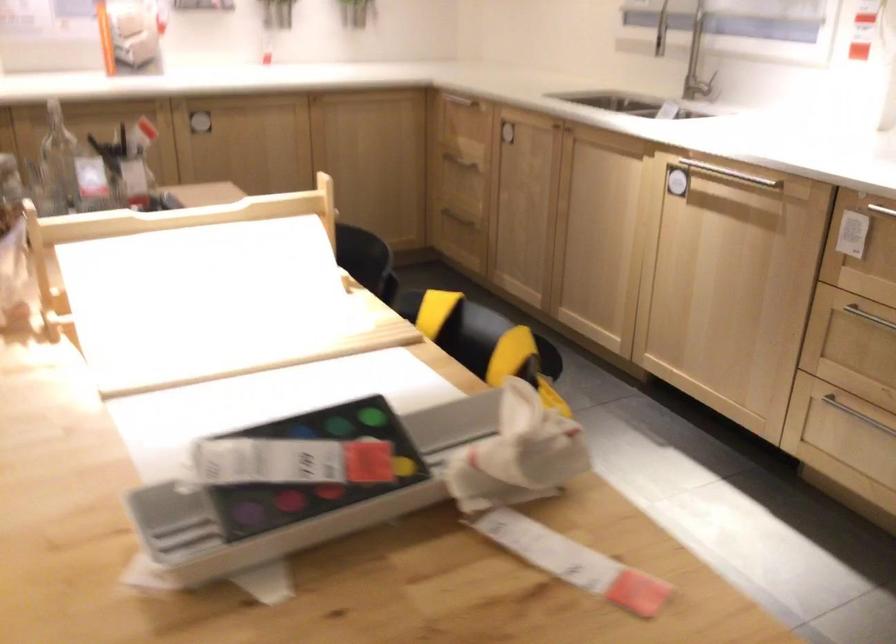
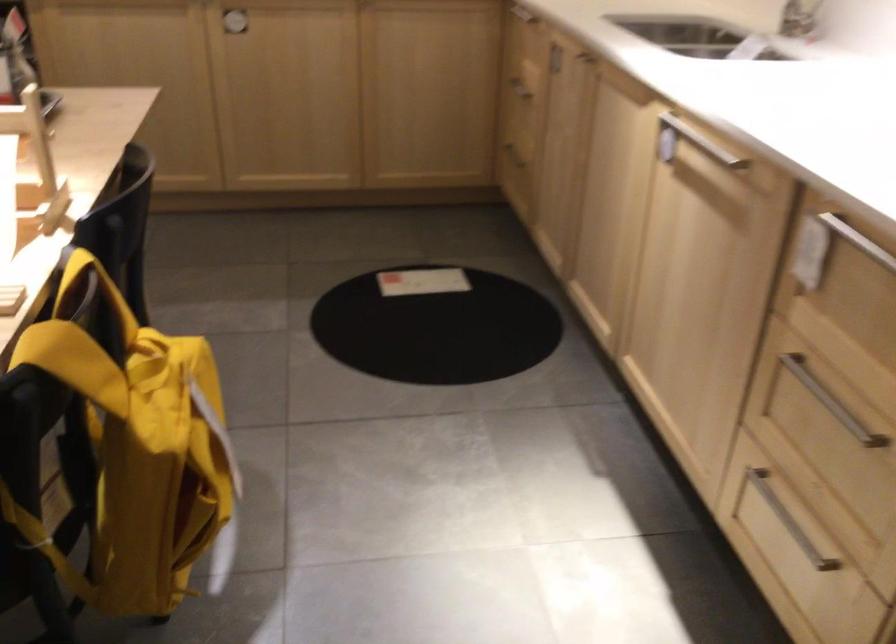
Question: The images are taken continuously from a first-person perspective. In which direction is your viewpoint rotating?

Choices:
 (A) Left
 (B) Right
 (C) Up
 (D) Down

Answer: (A)